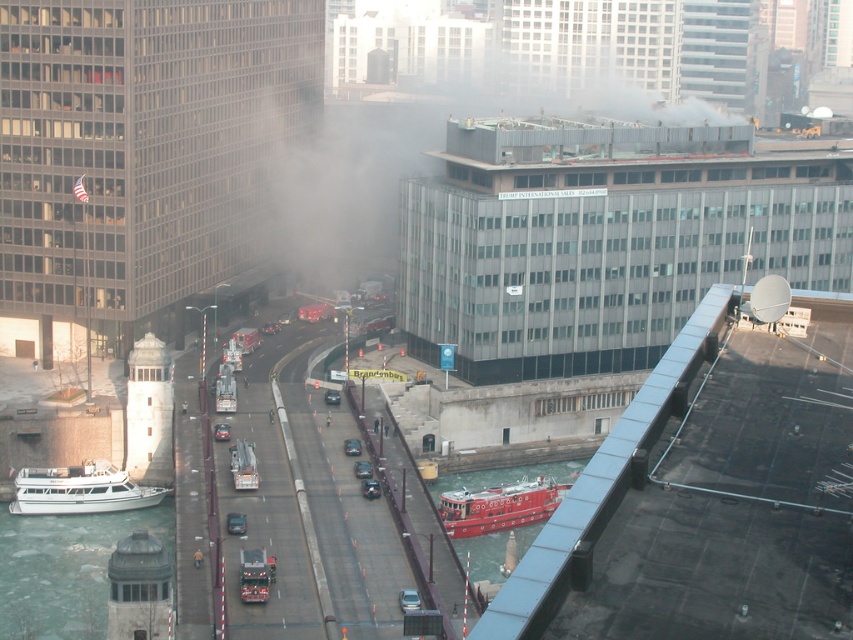
Question: Does greenish water at lower left have a larger size compared to white matte boat at lower left?

Choices:
 (A) yes
 (B) no

Answer: (A)

Question: Based on their relative distances, which object is nearer to the greenish water at lower left?

Choices:
 (A) red rubber fireboat at center
 (B) white matte boat at lower left

Answer: (B)

Question: Which point is farther to the camera?

Choices:
 (A) red rubber fireboat at center
 (B) white matte boat at lower left

Answer: (B)

Question: Considering the relative positions of smooth red boat at lower center and white matte boat at lower left in the image provided, where is smooth red boat at lower center located with respect to white matte boat at lower left?

Choices:
 (A) below
 (B) above

Answer: (A)

Question: Estimate the real-world distances between objects in this image. Which object is farther from the smooth red boat at lower center?

Choices:
 (A) white matte boat at lower left
 (B) red rubber fireboat at center
 (C) greenish water at lower left

Answer: (A)

Question: Does greenish water at lower left have a lesser width compared to red rubber fireboat at center?

Choices:
 (A) no
 (B) yes

Answer: (A)